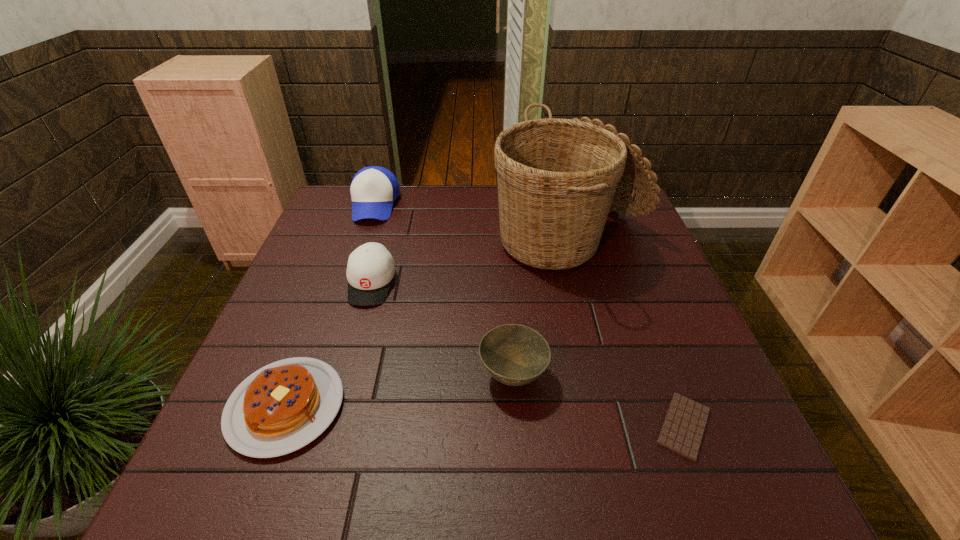
Find the location of a particular element. the tallest object is located at coordinates (557, 178).

Where is `the farther baseball cap`? This screenshot has height=540, width=960. the farther baseball cap is located at coordinates (373, 190).

Identify the location of the nearer baseball cap. Image resolution: width=960 pixels, height=540 pixels. (370, 269).

Where is `bowl`? Image resolution: width=960 pixels, height=540 pixels. bowl is located at coordinates (515, 355).

The width and height of the screenshot is (960, 540). Identify the location of pancake. (283, 406).

The image size is (960, 540). In order to click on chocolate bar in this screenshot , I will do `click(684, 425)`.

Find the location of a particular element. This screenshot has width=960, height=540. free location located on the left of the tallest object is located at coordinates (465, 239).

Identify the location of vacant space located 0.070m on the front-facing side of the farther baseball cap. (362, 240).

I want to click on vacant space situated 0.050m on the front-facing side of the nearer baseball cap, so click(360, 324).

Locate an element on the screen. free location located on the back of the bowl is located at coordinates (506, 278).